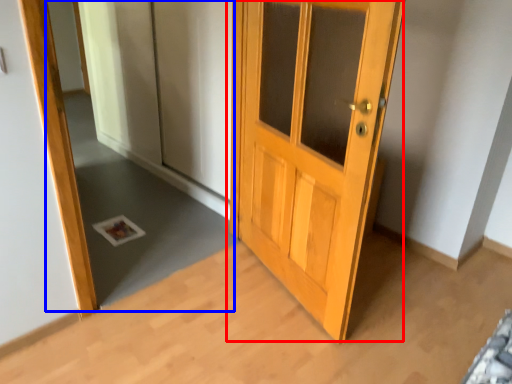
Question: Which of the following is the closest to the observer, door (highlighted by a red box) or mirror (highlighted by a blue box)?

Choices:
 (A) door
 (B) mirror

Answer: (A)